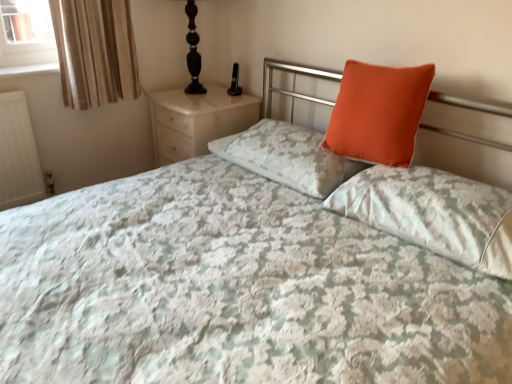
Question: From the image's perspective, is beige striped fabric at upper left under black glass table lamp at upper left?

Choices:
 (A) yes
 (B) no

Answer: (A)

Question: Is beige striped fabric at upper left beside black glass table lamp at upper left?

Choices:
 (A) yes
 (B) no

Answer: (B)

Question: Considering the relative sizes of beige striped fabric at upper left and black glass table lamp at upper left in the image provided, is beige striped fabric at upper left taller than black glass table lamp at upper left?

Choices:
 (A) no
 (B) yes

Answer: (B)

Question: Is beige striped fabric at upper left completely or partially outside of black glass table lamp at upper left?

Choices:
 (A) yes
 (B) no

Answer: (A)

Question: Can black glass table lamp at upper left be found inside beige striped fabric at upper left?

Choices:
 (A) no
 (B) yes

Answer: (A)

Question: Is beige striped fabric at upper left not close to black glass table lamp at upper left?

Choices:
 (A) no
 (B) yes

Answer: (A)

Question: Is beige striped fabric at upper left outside white marble nightstand at upper left?

Choices:
 (A) no
 (B) yes

Answer: (B)

Question: Can you confirm if beige striped fabric at upper left is wider than white marble nightstand at upper left?

Choices:
 (A) yes
 (B) no

Answer: (B)

Question: Is beige striped fabric at upper left at the left side of white marble nightstand at upper left?

Choices:
 (A) no
 (B) yes

Answer: (B)

Question: Does beige striped fabric at upper left have a smaller size compared to white marble nightstand at upper left?

Choices:
 (A) no
 (B) yes

Answer: (B)

Question: From the image's perspective, is beige striped fabric at upper left located above white marble nightstand at upper left?

Choices:
 (A) yes
 (B) no

Answer: (A)

Question: Does beige striped fabric at upper left come in front of white marble nightstand at upper left?

Choices:
 (A) no
 (B) yes

Answer: (B)

Question: From the image's perspective, is orange matte pillow at upper right, which appears as the 2th pillow when viewed from the right, over beige striped fabric at upper left?

Choices:
 (A) no
 (B) yes

Answer: (A)